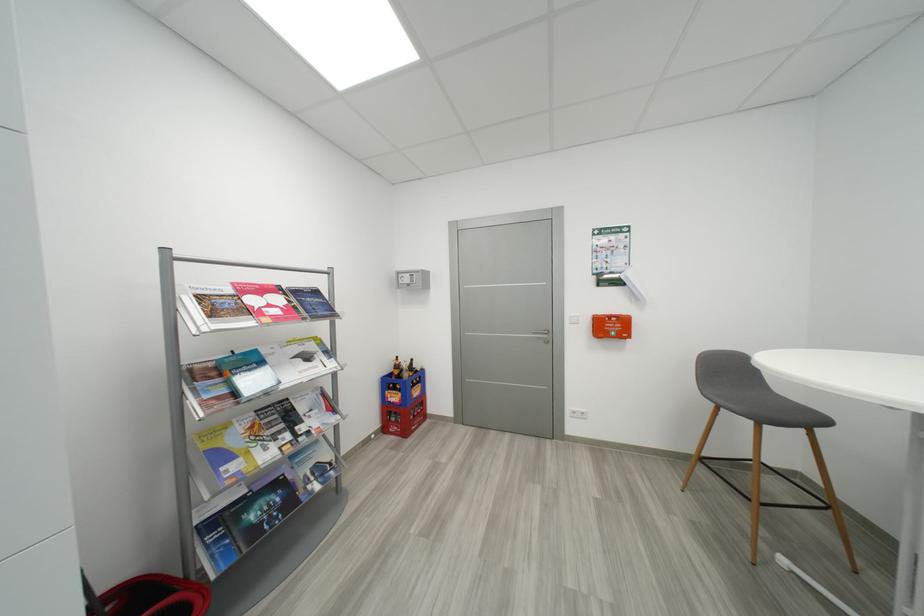
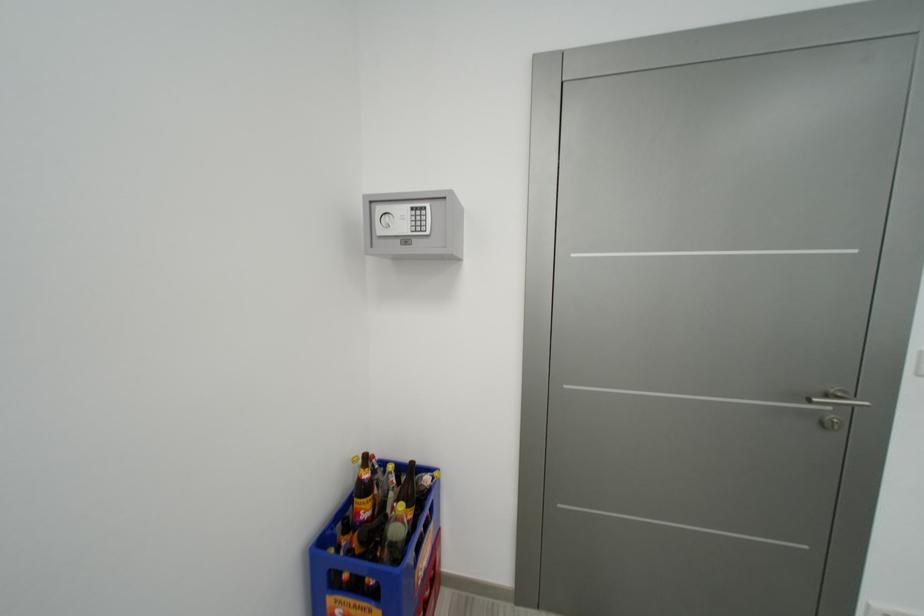
Question: In a continuous first-person perspective shot, in which direction is the camera moving?

Choices:
 (A) Left
 (B) Right
 (C) Forward
 (D) Backward

Answer: (C)